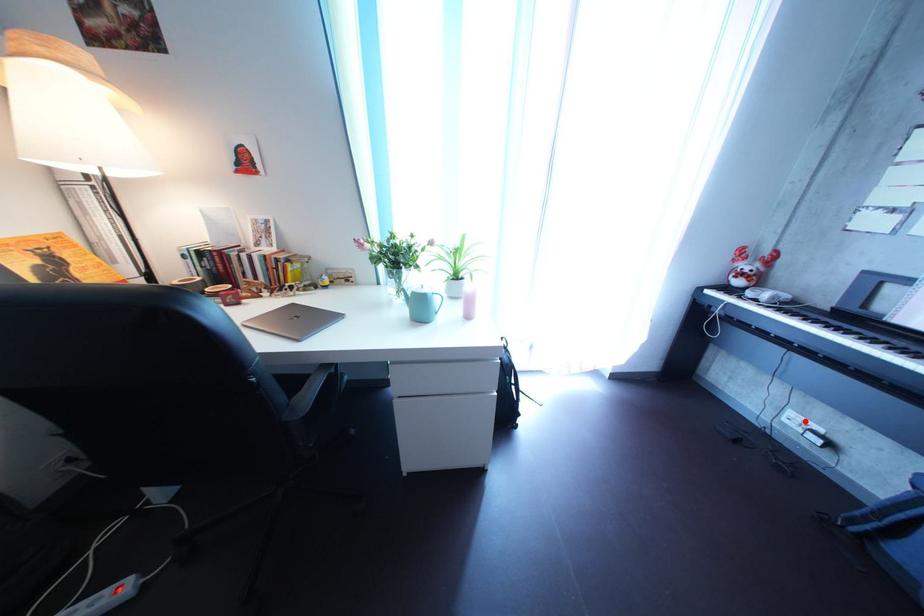
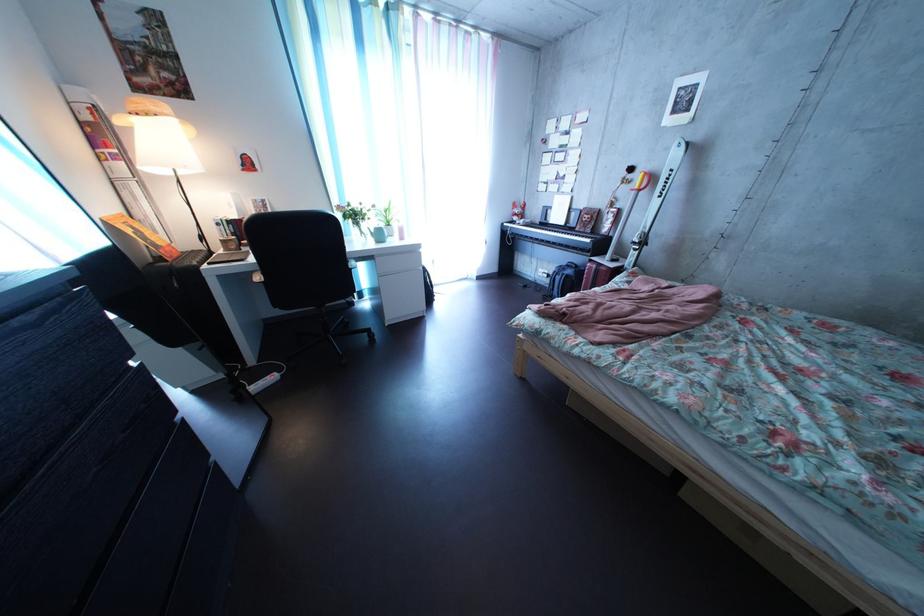
Locate, in the second image, the point that corresponds to the highlighted location in the first image.

(554, 278)